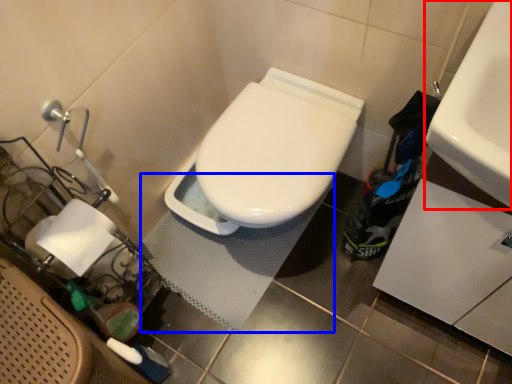
Question: Which object appears farthest to the camera in this image, sink (highlighted by a red box) or bath mat (highlighted by a blue box)?

Choices:
 (A) sink
 (B) bath mat

Answer: (B)